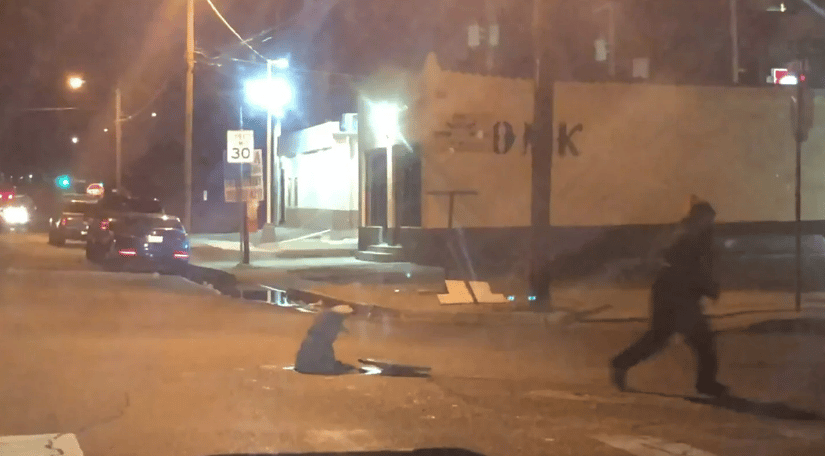
Find the location of a particular element. The height and width of the screenshot is (456, 825). green light is located at coordinates (67, 181).